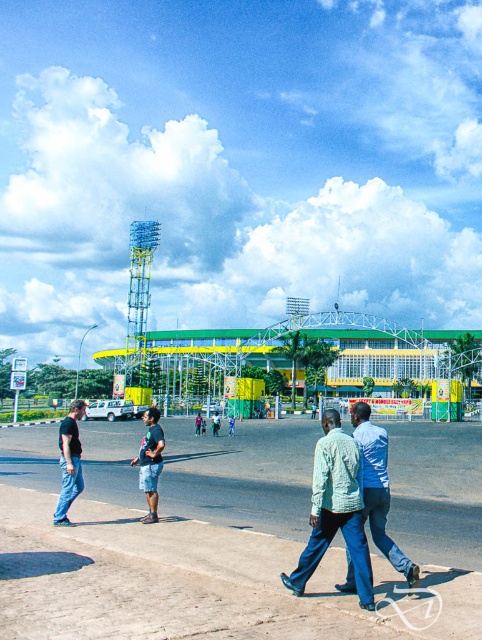
Does point (361, 524) come farther from viewer compared to point (362, 497)?

No, it is not.

Is light green fabric jacket at center smaller than light blue denim pants at center?

No.

Locate an element on the screen. Image resolution: width=482 pixels, height=640 pixels. light green fabric jacket at center is located at coordinates (334, 509).

Is light blue denim pants at center shorter than dark blue jeans at center?

Indeed, light blue denim pants at center has a lesser height compared to dark blue jeans at center.

Does light blue denim pants at center have a greater height compared to dark blue jeans at center?

No, light blue denim pants at center is not taller than dark blue jeans at center.

Between point (401, 552) and point (155, 413), which one is positioned in front?

Point (401, 552) is in front.

You are a GUI agent. You are given a task and a screenshot of the screen. Output one action in this format:
    pyautogui.click(x=<x>, y=<y>)
    Task: Click on the light blue denim pants at center
    
    Given the screenshot: What is the action you would take?
    pyautogui.click(x=377, y=486)

Measure the distance between point (75, 490) and camera.

They are 8.96 meters apart.

Is dark blue jeans at left bigger than dark blue jeans at center?

Indeed, dark blue jeans at left has a larger size compared to dark blue jeans at center.

Does point (62, 452) come behind point (149, 433)?

That is False.

Where is `dark blue jeans at left`? Image resolution: width=482 pixels, height=640 pixels. dark blue jeans at left is located at coordinates (68, 461).